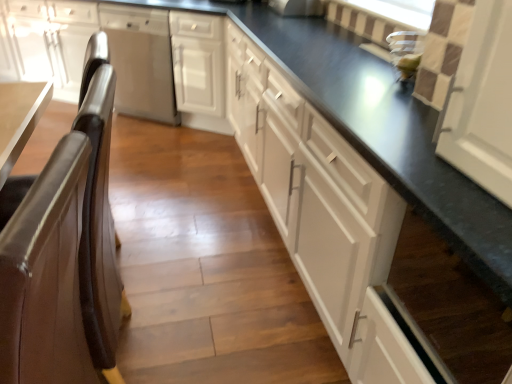
Question: From the image's perspective, is satin stainless steel dishwasher at left, marked as the 1th cabinetry in a left-to-right arrangement, above or below stainless steel dishwasher at center?

Choices:
 (A) above
 (B) below

Answer: (A)

Question: Choose the correct answer: Is satin stainless steel dishwasher at left, which is the third cabinetry from right to left, inside stainless steel dishwasher at center or outside it?

Choices:
 (A) inside
 (B) outside

Answer: (B)

Question: Estimate the real-world distances between objects in this image. Which object is farther from the stainless steel dishwasher at center?

Choices:
 (A) white matte cabinet at center, the first cabinetry positioned from the right
 (B) satin stainless steel dishwasher at left, marked as the 1th cabinetry in a left-to-right arrangement
 (C) brown leather chair at left
 (D) white matte cabinet at center, arranged as the second cabinetry when viewed from the right

Answer: (C)

Question: Estimate the real-world distances between objects in this image. Which object is farther from the white matte cabinet at center, arranged as the second cabinetry when viewed from the right?

Choices:
 (A) white matte cabinet at center, marked as the 3th cabinetry in a left-to-right arrangement
 (B) stainless steel dishwasher at center
 (C) brown leather chair at left
 (D) satin stainless steel dishwasher at left, marked as the 1th cabinetry in a left-to-right arrangement

Answer: (C)